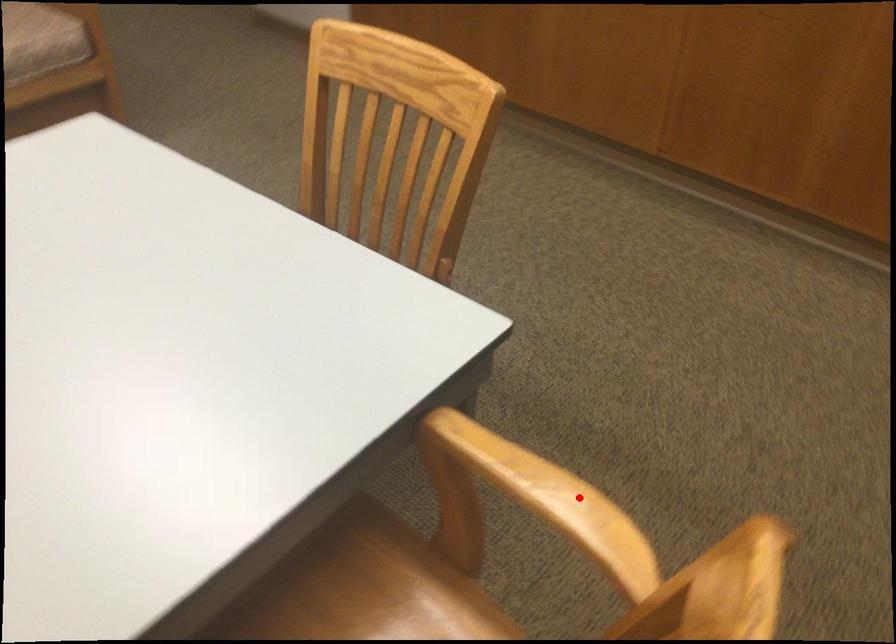
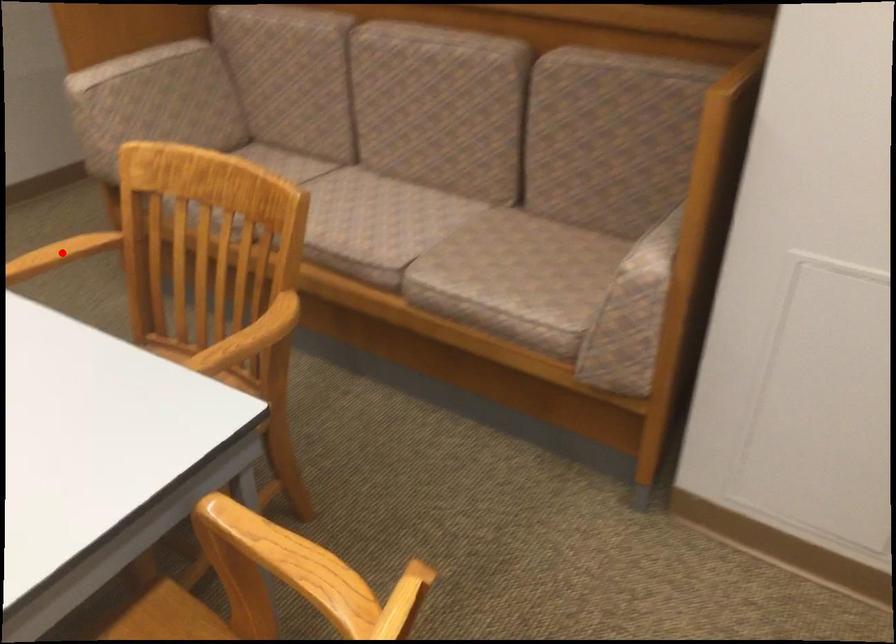
I am providing you with two images of the same scene from different viewpoints. A red point is marked on the first image and another point is marked on the second image. Is the red point in image1 aligned with the point shown in image2?

Yes